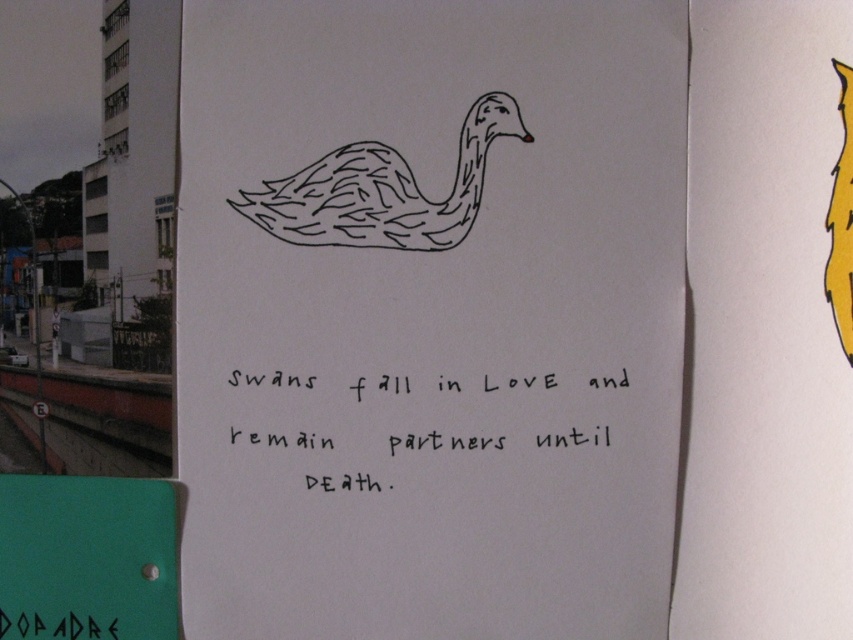
Which is behind, point (503, 124) or point (277, 440)?

The point (277, 440) is more distant.

From the picture: Does black line drawing swan at center come in front of black ink writing at center?

No, black line drawing swan at center is further to the viewer.

Which is in front, point (466, 147) or point (421, 433)?

Point (466, 147)

Identify the location of black line drawing swan at center. (381, 189).

Can you confirm if black line drawing swan at center is positioned above yellow matte feather at upper right?

Yes, black line drawing swan at center is above yellow matte feather at upper right.

Looking at this image, can you confirm if black line drawing swan at center is smaller than yellow matte feather at upper right?

Actually, black line drawing swan at center might be larger than yellow matte feather at upper right.

Where is `black line drawing swan at center`? This screenshot has height=640, width=853. black line drawing swan at center is located at coordinates (381, 189).

Can you confirm if black ink writing at center is shorter than yellow matte feather at upper right?

Yes, black ink writing at center is shorter than yellow matte feather at upper right.

From the picture: How much distance is there between black ink writing at center and yellow matte feather at upper right?

They are 8.06 inches apart.

Is point (395, 449) positioned in front of point (846, 132)?

No.

At what (x,y) coordinates should I click in order to perform the action: click on black ink writing at center. Please return your answer as a coordinate pair (x, y). The image size is (853, 640). Looking at the image, I should click on (440, 442).